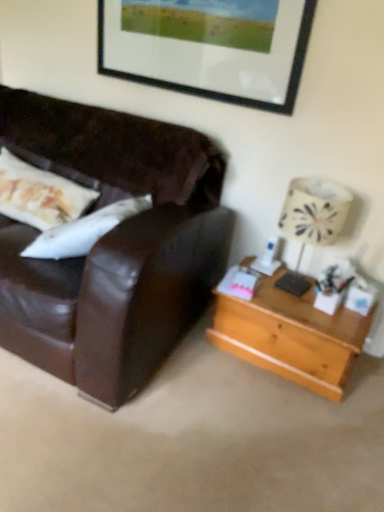
Where is `vacant area that is in front of white fabric lampshade at right`? Image resolution: width=384 pixels, height=512 pixels. vacant area that is in front of white fabric lampshade at right is located at coordinates (319, 313).